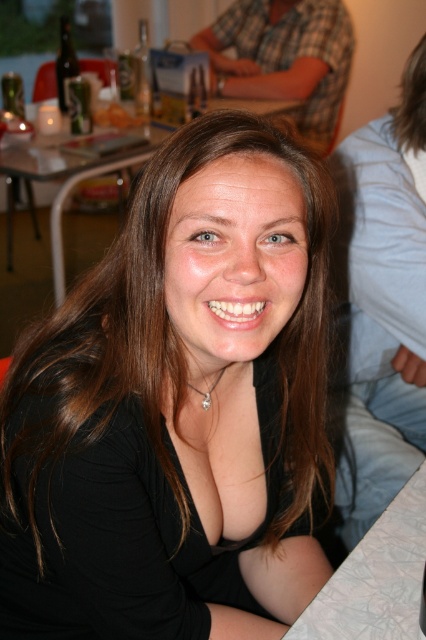
Question: Can you confirm if white textured table at lower right is thinner than white glossy table at center?

Choices:
 (A) no
 (B) yes

Answer: (B)

Question: Can you confirm if black matte shirt at center is smaller than white glossy table at center?

Choices:
 (A) no
 (B) yes

Answer: (B)

Question: Does white textured table at lower right come behind white glossy table at center?

Choices:
 (A) no
 (B) yes

Answer: (A)

Question: Which of these objects is positioned closest to the white glossy table at center?

Choices:
 (A) black matte shirt at center
 (B) white textured table at lower right

Answer: (A)

Question: Which point is closer to the camera?

Choices:
 (A) tap(164, 573)
 (B) tap(77, 157)
 (C) tap(391, 508)

Answer: (A)

Question: Which object is positioned farthest from the white textured table at lower right?

Choices:
 (A) white glossy table at center
 (B) black matte shirt at center

Answer: (A)